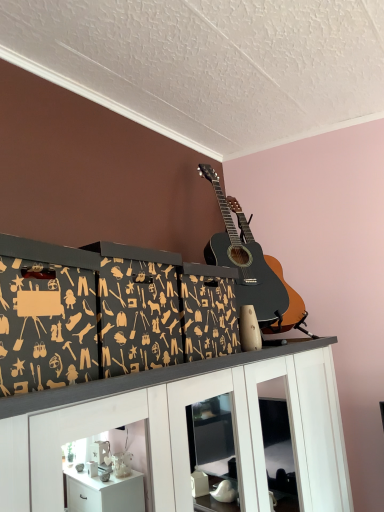
Question: Is point (59, 257) positioned closer to the camera than point (185, 458)?

Choices:
 (A) closer
 (B) farther

Answer: (A)

Question: Is black cardboard boxes at center situated inside white glossy cabinet at upper center or outside?

Choices:
 (A) outside
 (B) inside

Answer: (A)

Question: Estimate the real-world distances between objects in this image. Which object is closer to the white glossy cabinet at upper center?

Choices:
 (A) black cardboard boxes at center
 (B) black acoustic guitar at upper center

Answer: (A)

Question: Which object is the farthest from the white glossy cabinet at upper center?

Choices:
 (A) black acoustic guitar at upper center
 (B) black cardboard boxes at center

Answer: (A)